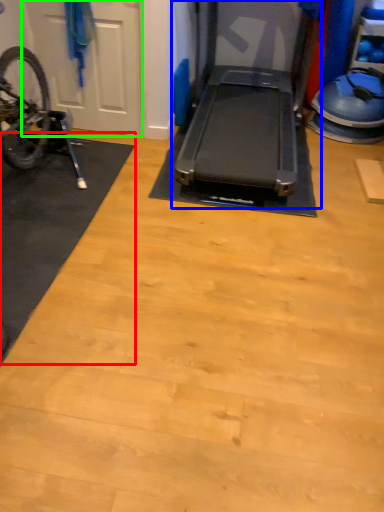
Question: Estimate the real-world distances between objects in this image. Which object is closer to mat (highlighted by a red box), treadmill (highlighted by a blue box) or garage door (highlighted by a green box)?

Choices:
 (A) treadmill
 (B) garage door

Answer: (B)